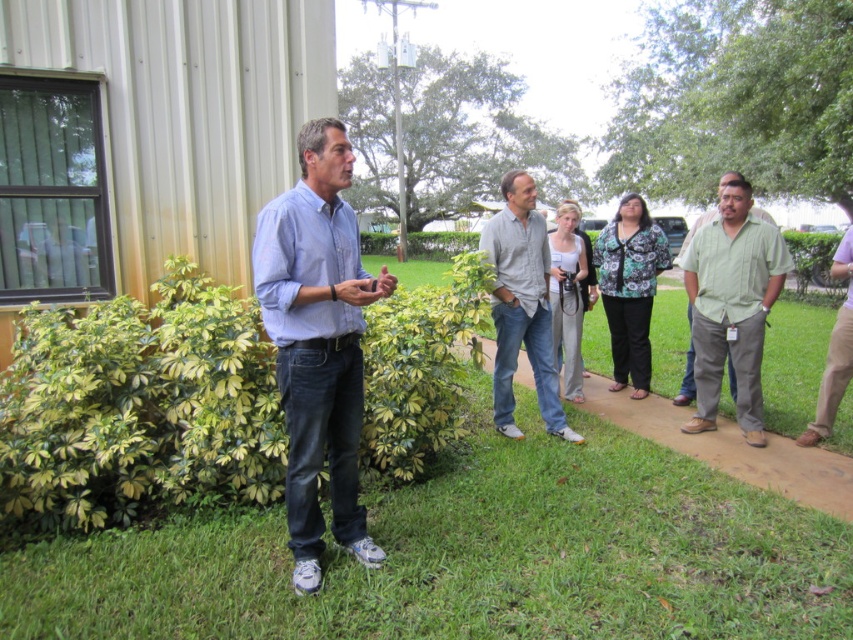
Image resolution: width=853 pixels, height=640 pixels. What do you see at coordinates (468, 554) in the screenshot?
I see `green grass at center` at bounding box center [468, 554].

From the picture: Which is below, green grass at center or gray cotton shirt at center?

green grass at center

Identify the location of green grass at center. This screenshot has height=640, width=853. (468, 554).

The image size is (853, 640). In order to click on green grass at center in this screenshot , I will do `click(468, 554)`.

Which of these two, green grass at center or denim jeans at center, stands taller?

denim jeans at center

Is point (253, 540) positioned after point (344, 321)?

Yes, point (253, 540) is behind point (344, 321).

Between point (473, 596) and point (302, 154), which one is positioned behind?

Point (473, 596)

This screenshot has height=640, width=853. Find the location of `green grass at center`. green grass at center is located at coordinates (468, 554).

Can you confirm if green grass at center is smaller than green cotton shirt at right?

No, green grass at center is not smaller than green cotton shirt at right.

Is the position of green grass at center less distant than that of green cotton shirt at right?

That is True.

Which is in front, point (252, 554) or point (715, 387)?

Positioned in front is point (252, 554).

Locate an element on the screen. Image resolution: width=853 pixels, height=640 pixels. green grass at center is located at coordinates (468, 554).